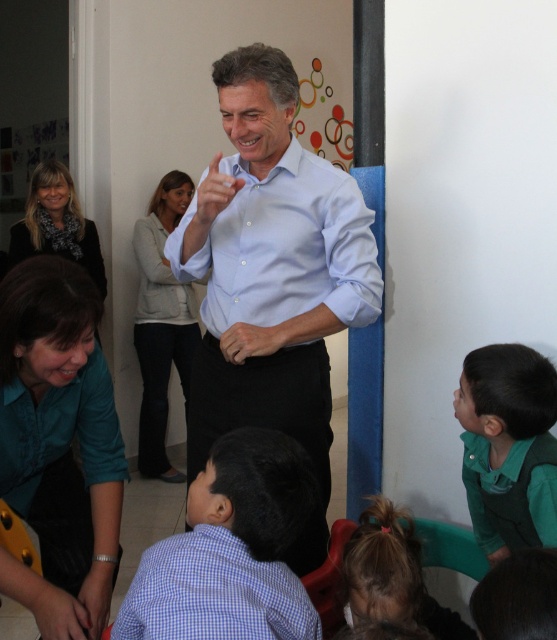
Question: Among these points, which one is nearest to the camera?

Choices:
 (A) (251, 179)
 (B) (33, 608)
 (C) (146, 582)
 (D) (106, 371)

Answer: (C)

Question: Does light blue shirt at center appear on the left side of matte black hand at lower left?

Choices:
 (A) no
 (B) yes

Answer: (A)

Question: Which of the following is the closest to the observer?

Choices:
 (A) matte black hand at lower left
 (B) green matte shirt at lower right
 (C) smooth skin hand at center
 (D) light blue cotton shirt at center

Answer: (A)

Question: Can you confirm if green matte shirt at lower right is smaller than matte blue shirt at center?

Choices:
 (A) yes
 (B) no

Answer: (B)

Question: Is the position of brown hair at lower center less distant than that of matte black hand at lower left?

Choices:
 (A) yes
 (B) no

Answer: (A)

Question: Which object is closer to the camera taking this photo?

Choices:
 (A) matte blue shirt at center
 (B) brown hair at lower center
 (C) teal matte dress shirt at lower left

Answer: (B)